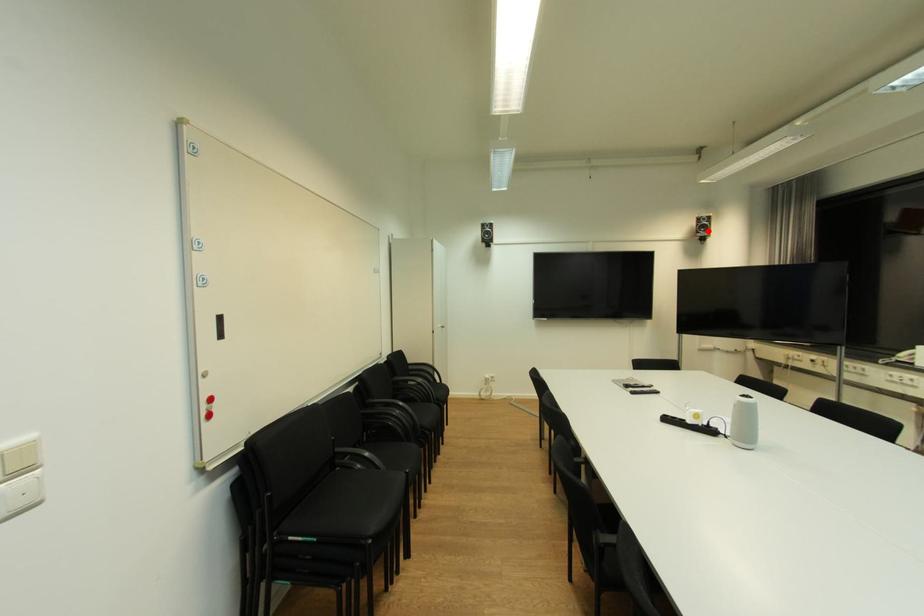
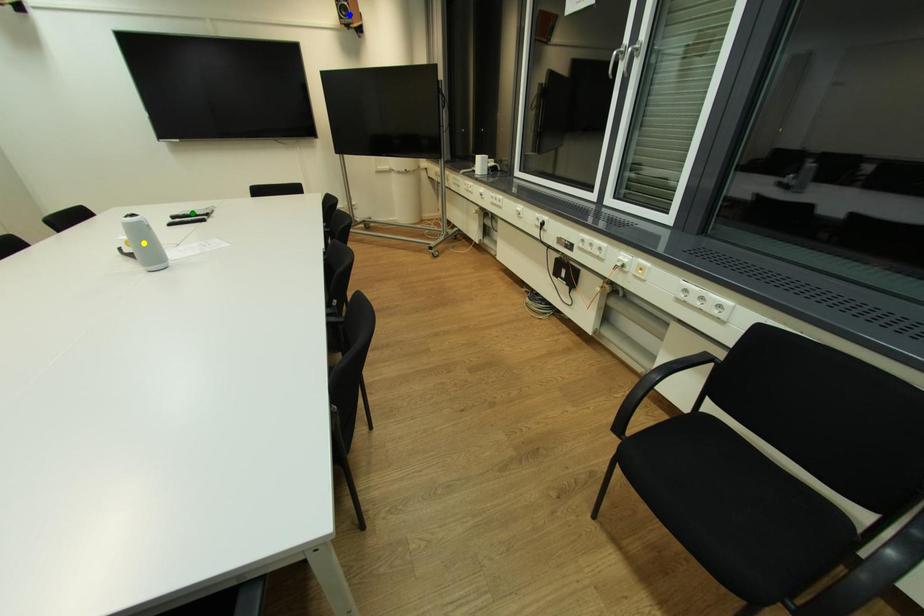
Question: I am providing you with two images of the same scene from different viewpoints. A red point is marked on the first image. You are given multiple points on the second image. Which point in image 2 represents the same 3d spot as the red point in image 1?

Choices:
 (A) yellow point
 (B) green point
 (C) blue point

Answer: (C)